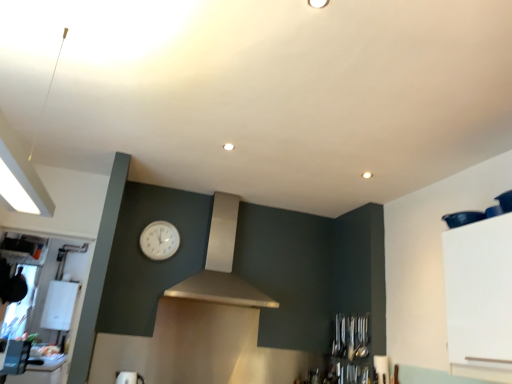
Question: Is white plastic clock at center located outside satin white vent at center?

Choices:
 (A) yes
 (B) no

Answer: (A)

Question: Does white plastic clock at center come behind satin white vent at center?

Choices:
 (A) no
 (B) yes

Answer: (B)

Question: Is white plastic clock at center taller than satin white vent at center?

Choices:
 (A) yes
 (B) no

Answer: (B)

Question: Considering the relative sizes of white plastic clock at center and satin white vent at center in the image provided, is white plastic clock at center bigger than satin white vent at center?

Choices:
 (A) no
 (B) yes

Answer: (A)

Question: Is white plastic clock at center next to satin white vent at center and touching it?

Choices:
 (A) no
 (B) yes

Answer: (A)

Question: Considering the positions of satin white vent at center and white plastic clock at center in the image, is satin white vent at center wider or thinner than white plastic clock at center?

Choices:
 (A) wide
 (B) thin

Answer: (A)

Question: From a real-world perspective, relative to white plastic clock at center, is satin white vent at center vertically above or below?

Choices:
 (A) below
 (B) above

Answer: (A)

Question: Considering their positions, is satin white vent at center located in front of or behind white plastic clock at center?

Choices:
 (A) front
 (B) behind

Answer: (A)

Question: From the image's perspective, relative to white plastic clock at center, is satin white vent at center above or below?

Choices:
 (A) above
 (B) below

Answer: (B)

Question: In the image, is white plastic clock at center positioned in front of or behind satin white vent at center?

Choices:
 (A) behind
 (B) front

Answer: (A)

Question: From the image's perspective, is white plastic clock at center above or below satin white vent at center?

Choices:
 (A) below
 (B) above

Answer: (B)

Question: Considering the positions of white plastic clock at center and satin white vent at center in the image, is white plastic clock at center bigger or smaller than satin white vent at center?

Choices:
 (A) big
 (B) small

Answer: (B)

Question: Would you say white plastic clock at center is inside or outside satin white vent at center?

Choices:
 (A) outside
 (B) inside

Answer: (A)

Question: From the image's perspective, is white plastic boiler at left, the second appliance in the right-to-left sequence, located above or below white plastic toaster at lower left, the 2th appliance from the back?

Choices:
 (A) above
 (B) below

Answer: (B)

Question: From a real-world perspective, relative to white plastic toaster at lower left, arranged as the 1th appliance when viewed from the right, is white plastic boiler at left, the first appliance viewed from the back, vertically above or below?

Choices:
 (A) below
 (B) above

Answer: (B)